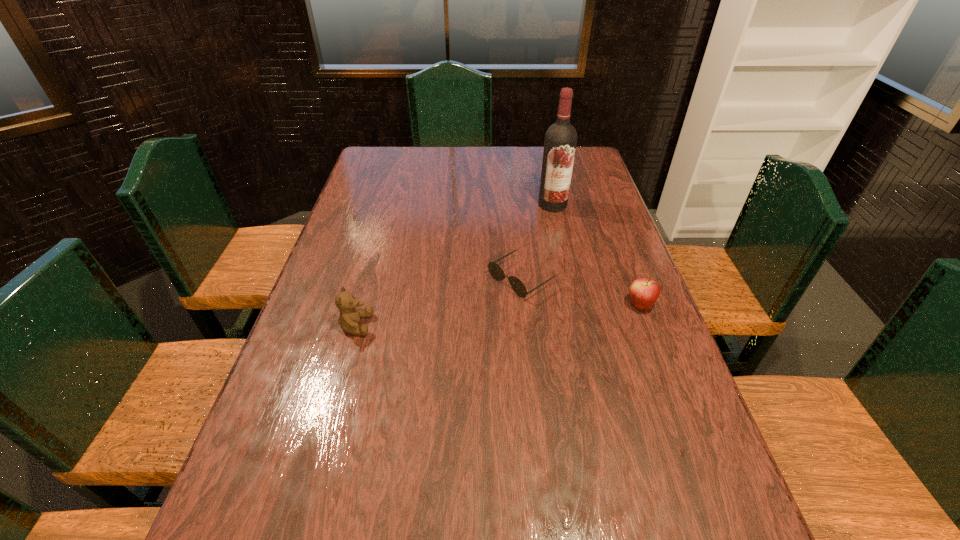
Identify the location of free region located 0.170m on the front-facing side of the sunglasses. (446, 325).

Find the location of a particular element. The height and width of the screenshot is (540, 960). vacant area situated on the front-facing side of the sunglasses is located at coordinates (468, 312).

Locate an element on the screen. Image resolution: width=960 pixels, height=540 pixels. vacant region located 0.350m on the front-facing side of the sunglasses is located at coordinates [386, 363].

The image size is (960, 540). In order to click on object positioned at the left edge in this screenshot , I will do (349, 318).

This screenshot has height=540, width=960. What are the coordinates of `apple that is at the right edge` in the screenshot? It's located at (644, 292).

At what (x,y) coordinates should I click in order to perform the action: click on wine bottle that is at the right edge. Please return your answer as a coordinate pair (x, y). Image resolution: width=960 pixels, height=540 pixels. Looking at the image, I should click on (560, 142).

The height and width of the screenshot is (540, 960). In the image, there is a desktop. In order to click on vacant space at the far edge in this screenshot , I will do `click(497, 147)`.

Where is `vacant area at the near edge of the desktop`? vacant area at the near edge of the desktop is located at coordinates (511, 476).

Image resolution: width=960 pixels, height=540 pixels. In the image, there is a desktop. Identify the location of blank space at the left edge. (367, 219).

This screenshot has height=540, width=960. I want to click on vacant region at the right edge, so click(x=596, y=210).